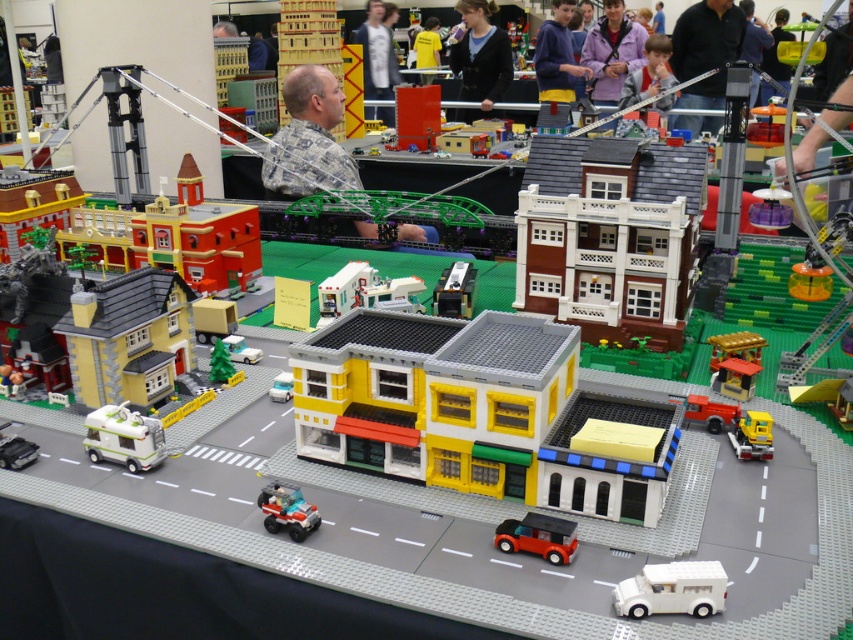
In the scene shown: You are a Lego figure standing on the sidewalk in the Lego cityscape. You see a shiny red car at lower center and a translucent red plastic car at center. Which car is closer to you?

The shiny red car at lower center is closer to you because it is in front of the translucent red plastic car at center.

In the Lego cityscape, you see a shiny red car at lower center and a translucent red plastic car at center. Which car is shorter in height?

The shiny red car at lower center is shorter in height compared to the translucent red plastic car at center.

You are a drone operator trying to deliver a package to the yellow matte building at center. Your drone can only fly over the Lego cityscape shown in the image. Based on the coordinates provided, can you confirm if the point at (436,396) is directly above the yellow matte building at center?

A: Yes, the point at (436,396) is directly above the yellow matte building at center as stated in the objects description.